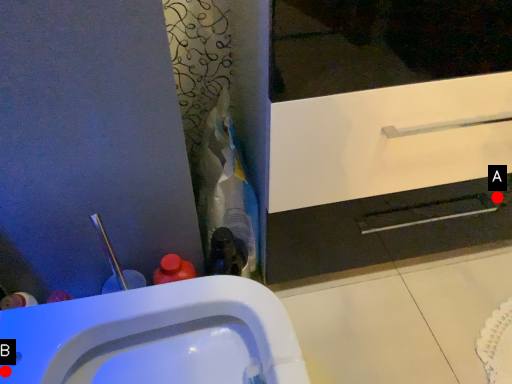
Question: Two points are circled on the image, labeled by A and B beside each circle. Which point is farther to the camera?

Choices:
 (A) A is further
 (B) B is further

Answer: (A)